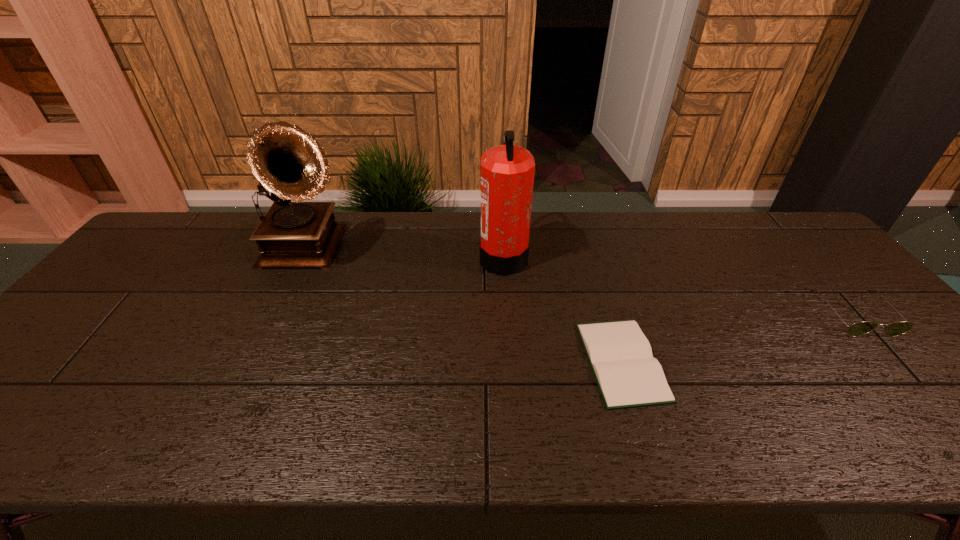
Identify the location of the closest object to the fire extinguisher. The height and width of the screenshot is (540, 960). (628, 376).

What are the coordinates of `free space that satisfies the following two spatial constraints: 1. on the back side of the third object from left to right; 2. on the horn of the leftmost object` in the screenshot? It's located at (588, 251).

Where is `vacant space that satisfies the following two spatial constraints: 1. on the horn of the record player; 2. on the right side of the shortest object`? This screenshot has height=540, width=960. vacant space that satisfies the following two spatial constraints: 1. on the horn of the record player; 2. on the right side of the shortest object is located at coordinates pos(254,361).

Identify the location of free point that satisfies the following two spatial constraints: 1. on the front side of the fire extinguisher; 2. on the left side of the hardback book. (510, 361).

Find the location of a particular element. This screenshot has height=540, width=960. vacant position in the image that satisfies the following two spatial constraints: 1. on the front side of the third object from left to right; 2. on the right side of the fire extinguisher is located at coordinates (510, 361).